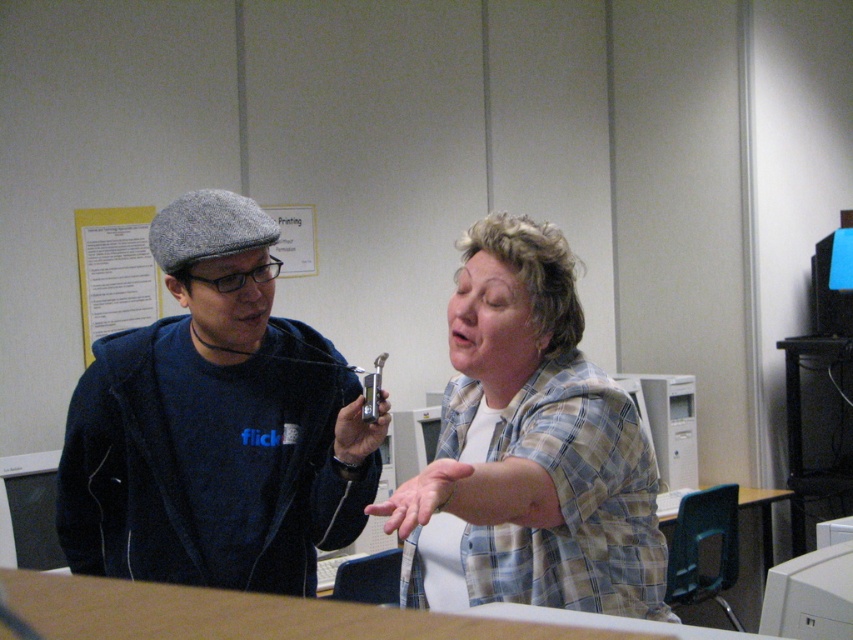
Consider the image. Where is the dark blue fabric sweatshirt at left located in the image?

The dark blue fabric sweatshirt at left is located at point (215, 424) in the image.